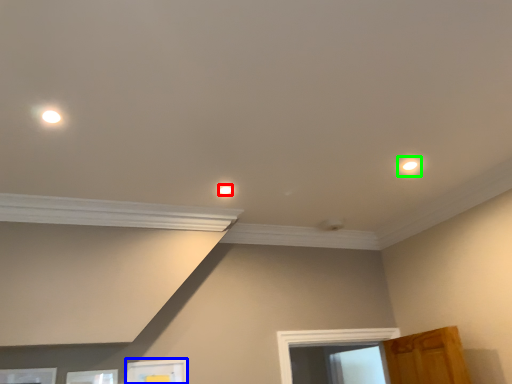
Question: Estimate the real-world distances between objects in this image. Which object is farther from dot (highlighted by a red box), picture frame (highlighted by a blue box) or dot (highlighted by a green box)?

Choices:
 (A) picture frame
 (B) dot

Answer: (A)